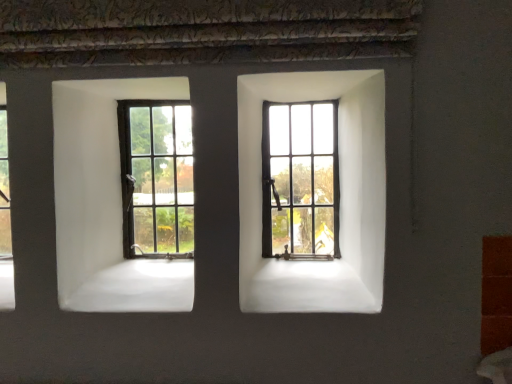
Question: From their relative heights in the image, would you say matte black window at center left, arranged as the 2th window when viewed from the right, is taller or shorter than matte black window at center, the 1th window in the right-to-left sequence?

Choices:
 (A) short
 (B) tall

Answer: (B)

Question: Is point (126, 150) positioned closer to the camera than point (274, 173)?

Choices:
 (A) closer
 (B) farther

Answer: (A)

Question: Is matte black window at center left, which is the first window in left-to-right order, inside the boundaries of matte black window at center, the 1th window in the right-to-left sequence, or outside?

Choices:
 (A) inside
 (B) outside

Answer: (B)

Question: Considering the positions of matte black window at center, placed as the 2th window when sorted from left to right, and matte black window at center left, which is the first window in left-to-right order, in the image, is matte black window at center, placed as the 2th window when sorted from left to right, wider or thinner than matte black window at center left, which is the first window in left-to-right order,?

Choices:
 (A) wide
 (B) thin

Answer: (B)

Question: From a real-world perspective, is matte black window at center, placed as the 2th window when sorted from left to right, positioned above or below matte black window at center left, arranged as the 2th window when viewed from the right?

Choices:
 (A) above
 (B) below

Answer: (B)

Question: Is point (318, 107) positioned closer to the camera than point (188, 144)?

Choices:
 (A) closer
 (B) farther

Answer: (A)

Question: Visually, is matte black window at center, the 1th window in the right-to-left sequence, positioned to the left or to the right of matte black window at center left, which is the first window in left-to-right order?

Choices:
 (A) right
 (B) left

Answer: (A)